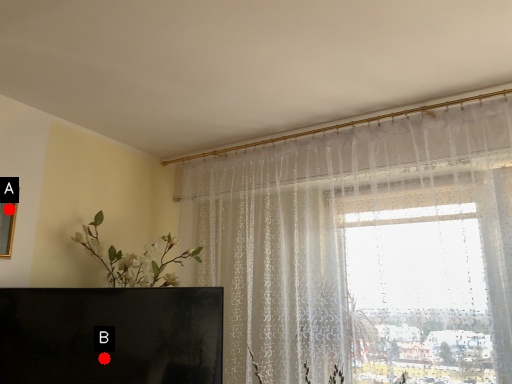
Question: Two points are circled on the image, labeled by A and B beside each circle. Among these points, which one is nearest to the camera?

Choices:
 (A) A is closer
 (B) B is closer

Answer: (B)